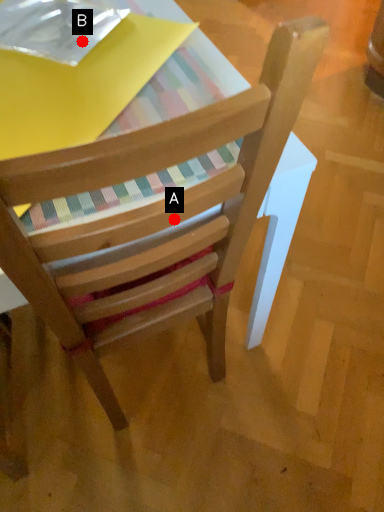
Question: Two points are circled on the image, labeled by A and B beside each circle. Among these points, which one is farthest from the camera?

Choices:
 (A) A is further
 (B) B is further

Answer: (B)